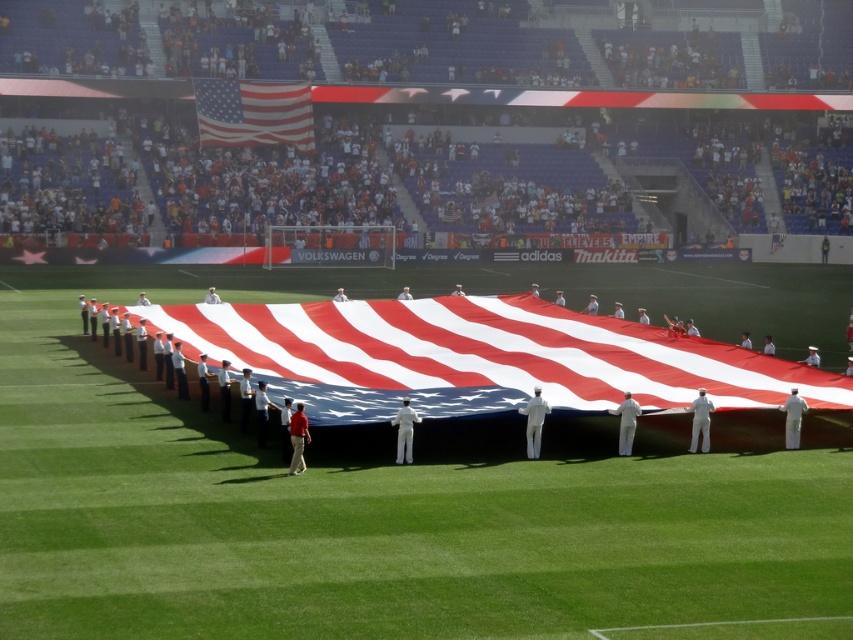
Who is positioned more to the left, red-white striped fabric at center or matte fabric flag at upper center?

matte fabric flag at upper center

Who is more distant from viewer, (506, 392) or (236, 124)?

The point (236, 124) is behind.

Between point (383, 412) and point (239, 84), which one is positioned in front?

Positioned in front is point (383, 412).

You are a GUI agent. You are given a task and a screenshot of the screen. Output one action in this format:
    pyautogui.click(x=<x>, y=<y>)
    Task: Click on the red-white striped fabric at center
    
    Given the screenshot: What is the action you would take?
    pyautogui.click(x=479, y=356)

Based on the photo, between american flag at center and red-white striped fabric at center, which one is positioned higher?

red-white striped fabric at center is above.

Does american flag at center come behind red-white striped fabric at center?

No, american flag at center is closer to the viewer.

Does point (33, 454) lie behind point (462, 372)?

No.

You are a GUI agent. You are given a task and a screenshot of the screen. Output one action in this format:
    pyautogui.click(x=<x>, y=<y>)
    Task: Click on the american flag at center
    The width and height of the screenshot is (853, 640).
    Given the screenshot: What is the action you would take?
    pyautogui.click(x=383, y=504)

Does point (222, 550) come behind point (218, 118)?

No, it is not.

Who is more forward, (605,476) or (296,125)?

Positioned in front is point (605,476).

The height and width of the screenshot is (640, 853). What are the coordinates of `american flag at center` in the screenshot? It's located at (383, 504).